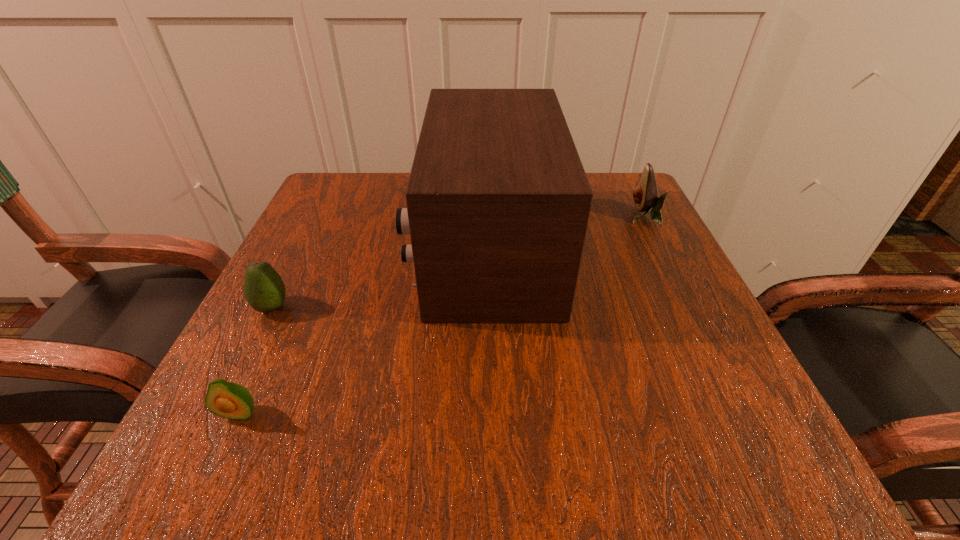
Find the location of a particular element. Image resolution: width=960 pixels, height=540 pixels. vacant space situated 0.280m on the seed side of the rightmost avocado is located at coordinates (502, 217).

Identify the location of vacant space situated 0.230m on the seed side of the rightmost avocado. (525, 217).

Where is `vacant space situated 0.140m on the right of the second nearest avocado`? vacant space situated 0.140m on the right of the second nearest avocado is located at coordinates (372, 307).

Where is `free space located on the cut side of the nearest object`? This screenshot has width=960, height=540. free space located on the cut side of the nearest object is located at coordinates (217, 462).

Find the location of a particular element. The image size is (960, 540). radio receiver at the far edge is located at coordinates (498, 202).

Find the location of a particular element. This screenshot has width=960, height=540. avocado that is at the far edge is located at coordinates (645, 194).

The width and height of the screenshot is (960, 540). In order to click on object at the near edge in this screenshot , I will do `click(229, 400)`.

The height and width of the screenshot is (540, 960). Identify the location of object that is at the right edge. (645, 194).

The width and height of the screenshot is (960, 540). I want to click on object at the near left corner, so click(229, 400).

Identify the location of object that is at the far right corner. (645, 194).